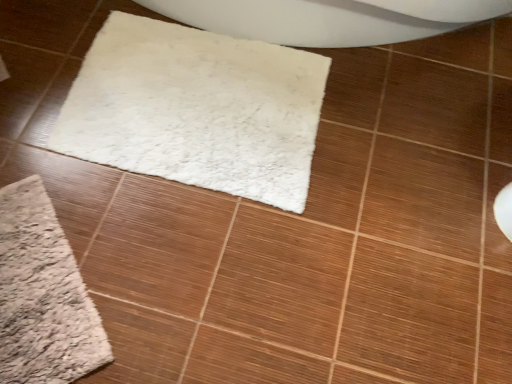
What are the coordinates of `free space to the right of beige fuzzy bath mat at lower left` in the screenshot? It's located at (170, 278).